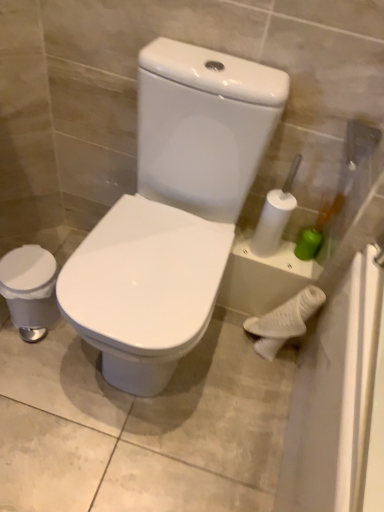
You are a GUI agent. You are given a task and a screenshot of the screen. Output one action in this format:
    pyautogui.click(x=<x>, y=<y>)
    Task: Click on the vacant space situated above white glossy trash can at left, the 1th porcelain in the left-to-right sequence (from a real-world perspective)
    
    Given the screenshot: What is the action you would take?
    pyautogui.click(x=20, y=266)